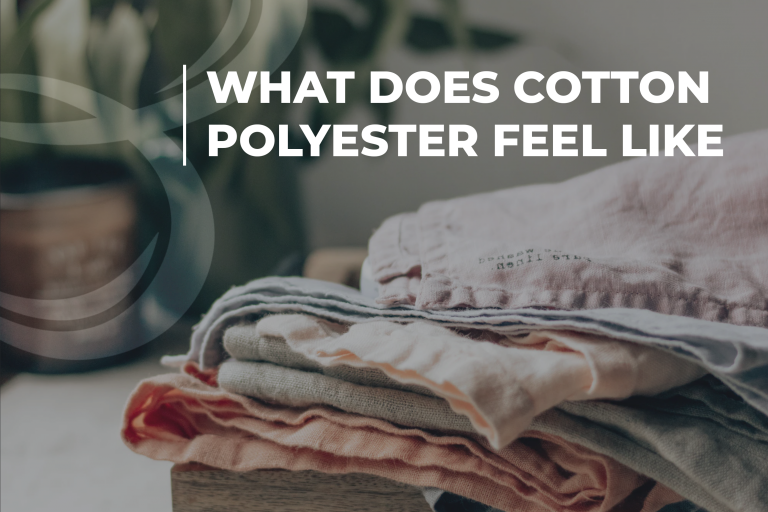
The width and height of the screenshot is (768, 512). Find the location of `looks like a green plant`. looks like a green plant is located at coordinates (382, 28).